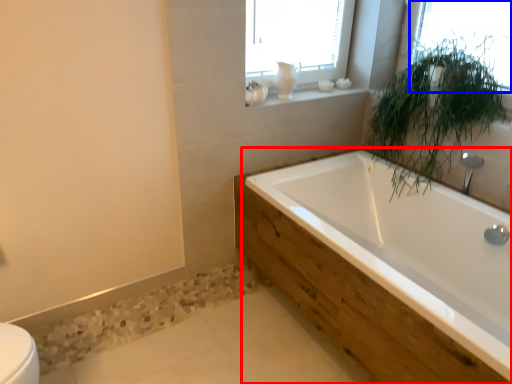
Question: Which of the following is the closest to the observer, bathtub (highlighted by a red box) or window (highlighted by a blue box)?

Choices:
 (A) bathtub
 (B) window

Answer: (A)